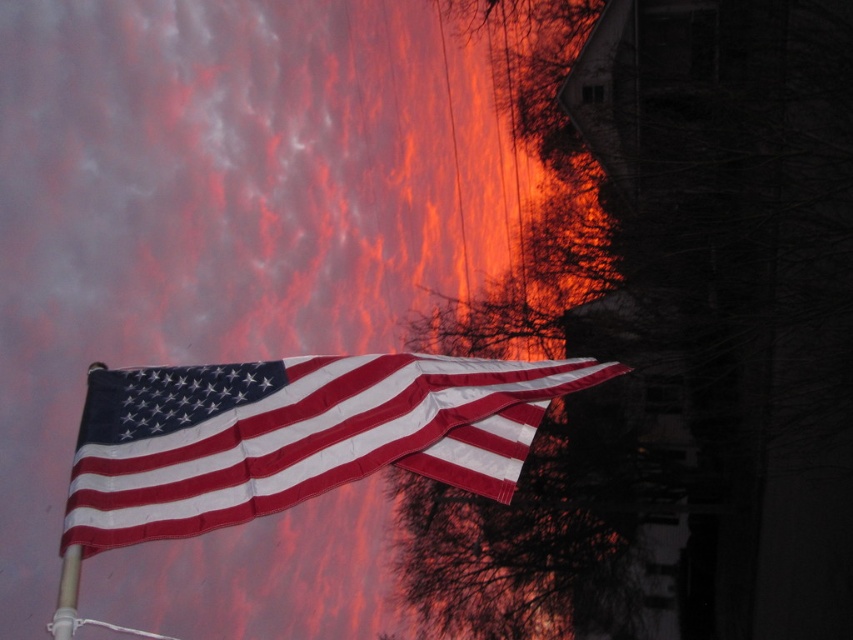
Question: Is matte fabric flag at center smaller than white plastic flag pole at lower left?

Choices:
 (A) no
 (B) yes

Answer: (A)

Question: Which of the following is the farthest from the observer?

Choices:
 (A) (125, 513)
 (B) (70, 566)

Answer: (A)

Question: Which point is closer to the camera taking this photo?

Choices:
 (A) (62, 628)
 (B) (160, 387)

Answer: (A)

Question: Which point is closer to the camera?

Choices:
 (A) white plastic flag pole at lower left
 (B) matte fabric flag at center

Answer: (A)

Question: Does matte fabric flag at center appear under white plastic flag pole at lower left?

Choices:
 (A) no
 (B) yes

Answer: (A)

Question: Considering the relative positions of matte fabric flag at center and white plastic flag pole at lower left in the image provided, where is matte fabric flag at center located with respect to white plastic flag pole at lower left?

Choices:
 (A) below
 (B) above

Answer: (B)